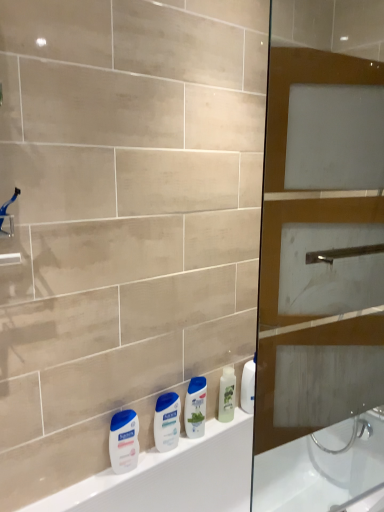
Question: From the image's perspective, would you say white glossy lotion at center, marked as the 2th toiletry in a front-to-back arrangement, is positioned over blue plastic shower head at upper left?

Choices:
 (A) yes
 (B) no

Answer: (B)

Question: Can you confirm if white glossy lotion at center, which is counted as the 2th toiletry, starting from the back, is shorter than blue plastic shower head at upper left?

Choices:
 (A) yes
 (B) no

Answer: (B)

Question: Is white glossy lotion at center, which is counted as the 2th toiletry, starting from the back, not within blue plastic shower head at upper left?

Choices:
 (A) yes
 (B) no

Answer: (A)

Question: Can you confirm if white glossy lotion at center, which is counted as the 2th toiletry, starting from the back, is thinner than blue plastic shower head at upper left?

Choices:
 (A) yes
 (B) no

Answer: (A)

Question: Considering the relative sizes of white glossy lotion at center, marked as the 2th toiletry in a front-to-back arrangement, and blue plastic shower head at upper left in the image provided, is white glossy lotion at center, marked as the 2th toiletry in a front-to-back arrangement, smaller than blue plastic shower head at upper left?

Choices:
 (A) no
 (B) yes

Answer: (B)

Question: From a real-world perspective, is white matte lotion at lower left, which ranks as the first toiletry in front-to-back order, above or below blue plastic shower head at upper left?

Choices:
 (A) above
 (B) below

Answer: (B)

Question: Relative to blue plastic shower head at upper left, is white matte lotion at lower left, the 3th toiletry positioned from the right, in front or behind?

Choices:
 (A) front
 (B) behind

Answer: (B)

Question: From the image's perspective, relative to blue plastic shower head at upper left, is white matte lotion at lower left, which ranks as the 1th toiletry in left-to-right order, above or below?

Choices:
 (A) above
 (B) below

Answer: (B)

Question: Considering the positions of white matte lotion at lower left, which ranks as the first toiletry in front-to-back order, and blue plastic shower head at upper left in the image, is white matte lotion at lower left, which ranks as the first toiletry in front-to-back order, taller or shorter than blue plastic shower head at upper left?

Choices:
 (A) short
 (B) tall

Answer: (B)

Question: From their relative heights in the image, would you say brown glass screen door at right is taller or shorter than white matte lotion at lower left, the 3th toiletry positioned from the right?

Choices:
 (A) short
 (B) tall

Answer: (B)

Question: Is brown glass screen door at right inside the boundaries of white matte lotion at lower left, the third toiletry when ordered from back to front, or outside?

Choices:
 (A) inside
 (B) outside

Answer: (B)

Question: Based on their sizes in the image, would you say brown glass screen door at right is bigger or smaller than white matte lotion at lower left, the 3th toiletry positioned from the right?

Choices:
 (A) small
 (B) big

Answer: (B)

Question: From the image's perspective, is brown glass screen door at right located above or below white matte lotion at lower left, the third toiletry when ordered from back to front?

Choices:
 (A) below
 (B) above

Answer: (B)

Question: From their relative heights in the image, would you say blue glossy shampoo at center is taller or shorter than blue plastic shower head at upper left?

Choices:
 (A) tall
 (B) short

Answer: (A)

Question: Looking at their shapes, would you say blue glossy shampoo at center is wider or thinner than blue plastic shower head at upper left?

Choices:
 (A) wide
 (B) thin

Answer: (B)